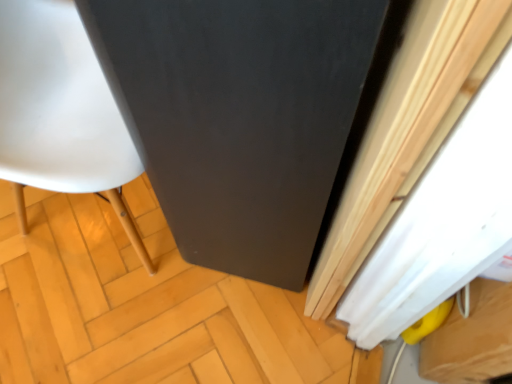
Question: Is point (38, 233) positioned closer to the camera than point (378, 102)?

Choices:
 (A) closer
 (B) farther

Answer: (B)

Question: Considering the positions of matte black cabinet at center and white matte curtain at right in the image, is matte black cabinet at center wider or thinner than white matte curtain at right?

Choices:
 (A) thin
 (B) wide

Answer: (B)

Question: Considering the real-world distances, which object is closest to the black matte screen door at center?

Choices:
 (A) white glossy chair at left
 (B) white matte curtain at right
 (C) matte black cabinet at center

Answer: (B)

Question: Which object is positioned closest to the white matte curtain at right?

Choices:
 (A) matte black cabinet at center
 (B) black matte screen door at center
 (C) white glossy chair at left

Answer: (B)